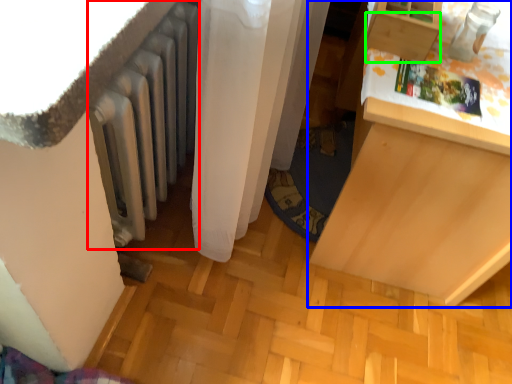
Question: Estimate the real-world distances between objects in this image. Which object is farther from radiator (highlighted by a red box), furniture (highlighted by a blue box) or drawer (highlighted by a green box)?

Choices:
 (A) furniture
 (B) drawer

Answer: (A)